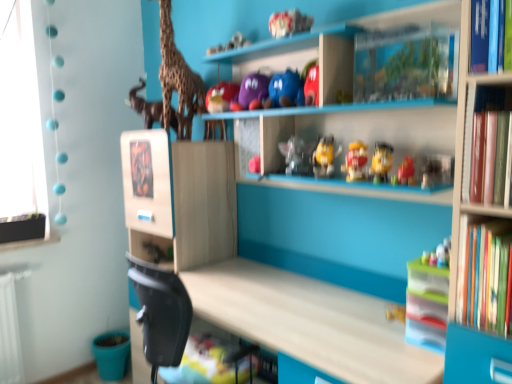
Question: Does translucent plastic toy at center, which ranks as the fifth toy in top-to-bottom order, lie behind wooden giraffe at upper left?

Choices:
 (A) yes
 (B) no

Answer: (B)

Question: Is translucent plastic toy at center, which ranks as the fifth toy in top-to-bottom order, in front of wooden giraffe at upper left?

Choices:
 (A) no
 (B) yes

Answer: (B)

Question: From the image's perspective, is translucent plastic toy at center, which ranks as the fifth toy in top-to-bottom order, beneath wooden giraffe at upper left?

Choices:
 (A) no
 (B) yes

Answer: (B)

Question: Is translucent plastic toy at center, which ranks as the fifth toy in top-to-bottom order, touching wooden giraffe at upper left?

Choices:
 (A) yes
 (B) no

Answer: (B)

Question: Is translucent plastic toy at center, which ranks as the fifth toy in top-to-bottom order, to the right of wooden giraffe at upper left from the viewer's perspective?

Choices:
 (A) no
 (B) yes

Answer: (B)

Question: Is translucent plastic toy at center, the 2th toy in the bottom-to-top sequence, positioned with its back to wooden giraffe at upper left?

Choices:
 (A) yes
 (B) no

Answer: (B)

Question: Is matte brown elephant at upper left taller than hardcover books at right?

Choices:
 (A) no
 (B) yes

Answer: (B)

Question: Does matte brown elephant at upper left lie in front of hardcover books at right?

Choices:
 (A) yes
 (B) no

Answer: (B)

Question: Is matte brown elephant at upper left positioned behind hardcover books at right?

Choices:
 (A) yes
 (B) no

Answer: (A)

Question: From a real-world perspective, is matte brown elephant at upper left positioned under hardcover books at right based on gravity?

Choices:
 (A) yes
 (B) no

Answer: (B)

Question: From the image's perspective, is matte brown elephant at upper left beneath hardcover books at right?

Choices:
 (A) no
 (B) yes

Answer: (A)

Question: Is matte brown elephant at upper left directly adjacent to hardcover books at right?

Choices:
 (A) yes
 (B) no

Answer: (B)

Question: From a real-world perspective, is translucent plastic toy at center, which ranks as the fifth toy in top-to-bottom order, on matte purple plush at upper center, which appears as the first toy when viewed from the top?

Choices:
 (A) yes
 (B) no

Answer: (B)